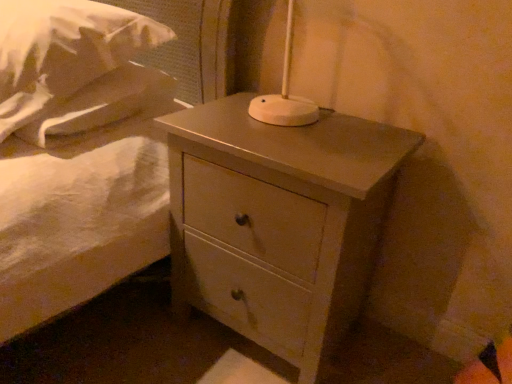
Describe the element at coordinates (68, 44) in the screenshot. I see `white soft pillow at upper left` at that location.

At what (x,y) coordinates should I click in order to perform the action: click on white soft pillow at upper left. Please return your answer as a coordinate pair (x, y). The image size is (512, 384). Looking at the image, I should click on (68, 44).

What do you see at coordinates (279, 222) in the screenshot? The height and width of the screenshot is (384, 512). I see `white matte nightstand at center` at bounding box center [279, 222].

Find the location of a particular element. The image size is (512, 384). white matte nightstand at center is located at coordinates (279, 222).

What is the approximate width of white matte nightstand at center?

17.51 inches.

Locate an element on the screen. The image size is (512, 384). white soft pillow at upper left is located at coordinates (68, 44).

Does white matte nightstand at center appear on the right side of white soft pillow at upper left?

Indeed, white matte nightstand at center is positioned on the right side of white soft pillow at upper left.

Considering the relative positions of white matte nightstand at center and white soft pillow at upper left in the image provided, is white matte nightstand at center in front of white soft pillow at upper left?

No.

Is point (281, 219) farther from camera compared to point (55, 45)?

No, it is not.

From the image's perspective, between white matte nightstand at center and white soft pillow at upper left, who is located below?

white matte nightstand at center appears lower in the image.

From a real-world perspective, is white matte nightstand at center on top of white soft pillow at upper left?

Incorrect, from a real-world perspective, white matte nightstand at center is lower than white soft pillow at upper left.

Which object is wider, white matte nightstand at center or white soft pillow at upper left?

white soft pillow at upper left.

Considering the relative sizes of white matte nightstand at center and white soft pillow at upper left in the image provided, is white matte nightstand at center taller than white soft pillow at upper left?

Indeed, white matte nightstand at center has a greater height compared to white soft pillow at upper left.

Considering the relative sizes of white matte nightstand at center and white soft pillow at upper left in the image provided, is white matte nightstand at center bigger than white soft pillow at upper left?

Correct, white matte nightstand at center is larger in size than white soft pillow at upper left.

Is white matte nightstand at center not within white soft pillow at upper left?

white matte nightstand at center lies outside white soft pillow at upper left's area.

Can you see white matte nightstand at center touching white soft pillow at upper left?

white matte nightstand at center is not next to white soft pillow at upper left, and they're not touching.

Is white matte nightstand at center positioned with its back to white soft pillow at upper left?

No, white soft pillow at upper left is not at the back of white matte nightstand at center.

What's the angular difference between white matte nightstand at center and white soft pillow at upper left's facing directions?

The facing directions of white matte nightstand at center and white soft pillow at upper left are 1.09 degrees apart.

This screenshot has width=512, height=384. What are the coordinates of `pillow on the left of white matte nightstand at center` in the screenshot? It's located at (68, 44).

Can you confirm if white soft pillow at upper left is positioned to the left of white matte nightstand at center?

Yes, white soft pillow at upper left is to the left of white matte nightstand at center.

Is the depth of white soft pillow at upper left greater than that of white matte nightstand at center?

No, white soft pillow at upper left is in front of white matte nightstand at center.

Does point (102, 29) come behind point (264, 285)?

Yes, point (102, 29) is behind point (264, 285).

From the image's perspective, is white soft pillow at upper left beneath white matte nightstand at center?

No, from the image's perspective, white soft pillow at upper left is not below white matte nightstand at center.

From a real-world perspective, which is physically below, white soft pillow at upper left or white matte nightstand at center?

white matte nightstand at center.

Looking at this image, does white soft pillow at upper left have a greater width compared to white matte nightstand at center?

Yes.

Between white soft pillow at upper left and white matte nightstand at center, which one has more height?

Standing taller between the two is white matte nightstand at center.

Who is bigger, white soft pillow at upper left or white matte nightstand at center?

With larger size is white matte nightstand at center.

Is white soft pillow at upper left spatially inside white matte nightstand at center, or outside of it?

A: white soft pillow at upper left cannot be found inside white matte nightstand at center.

Is white soft pillow at upper left with white matte nightstand at center?

No, white soft pillow at upper left is not making contact with white matte nightstand at center.

Is white soft pillow at upper left facing away from white matte nightstand at center?

white soft pillow at upper left does not have its back to white matte nightstand at center.

Can you tell me how much white soft pillow at upper left and white matte nightstand at center differ in facing direction?

The angular difference between white soft pillow at upper left and white matte nightstand at center is 1.09 degrees.

Identify the location of pillow that appears in front of the white matte nightstand at center. (68, 44).

Where is `nightstand beneath the white soft pillow at upper left (from a real-world perspective)`? Image resolution: width=512 pixels, height=384 pixels. nightstand beneath the white soft pillow at upper left (from a real-world perspective) is located at coordinates (279, 222).

Locate an element on the screen. nightstand on the right of white soft pillow at upper left is located at coordinates (279, 222).